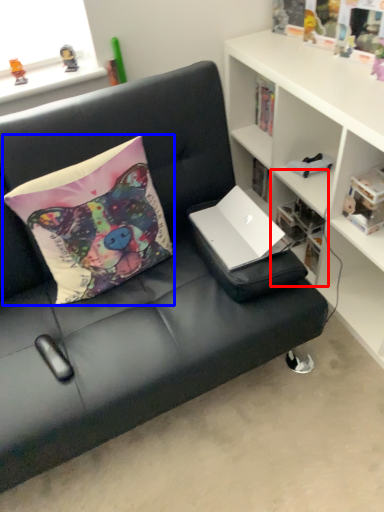
Question: Which point is closer to the camera, shelf (highlighted by a red box) or pillow (highlighted by a blue box)?

Choices:
 (A) shelf
 (B) pillow

Answer: (B)